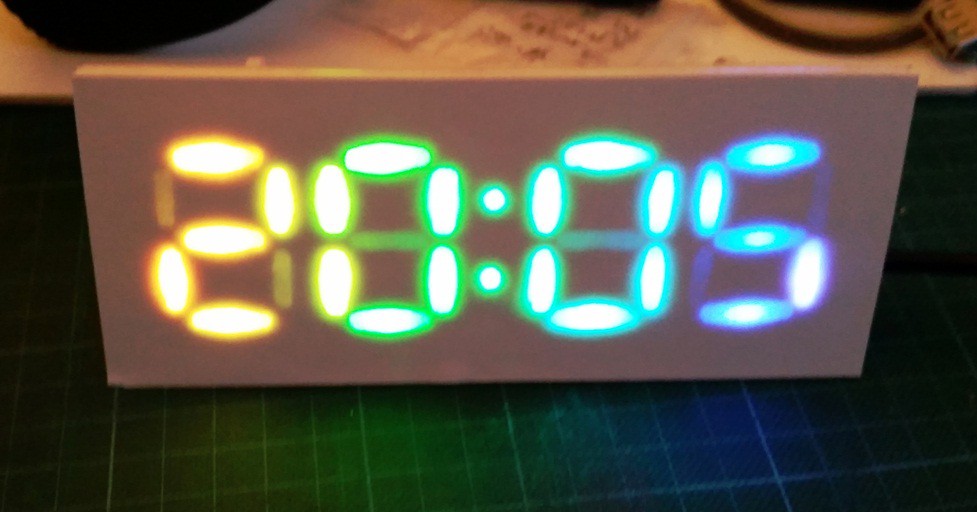
Where is `white rectangular surface`? white rectangular surface is located at coordinates (21, 73).